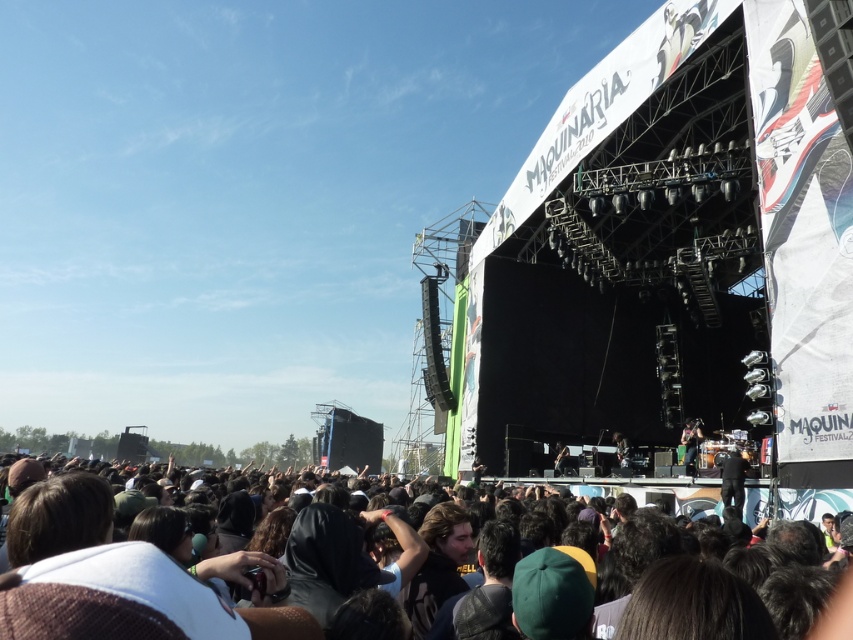
You are a photographer at the concert. You want to capture a photo that includes both the dark brown hair at lower center and the shiny black guitar at center. Which object should you adjust your camera angle to focus on first to ensure both are in the frame?

The dark brown hair at lower center might be wider than the shiny black guitar at center, so you should focus on the dark brown hair at lower center first to accommodate its width and ensure both are in the frame.

You are a photographer at the Maquinaria Festival 2010 concert. You need to capture a photo of the shiny black guitar at center and the person with dark brown hair at lower center. Based on their heights, which subject should you focus on first to ensure both are in frame?

The dark brown hair at lower center is taller than the shiny black guitar at center, so you should focus on the dark brown hair at lower center first to ensure both are in frame.